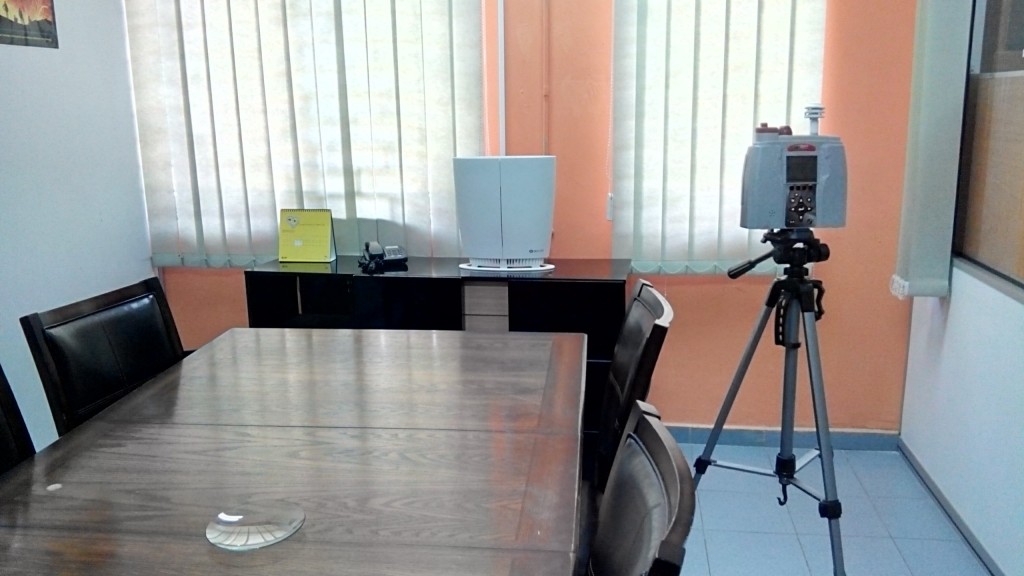
This screenshot has height=576, width=1024. What are the coordinates of `white wall` in the screenshot? It's located at (995, 403).